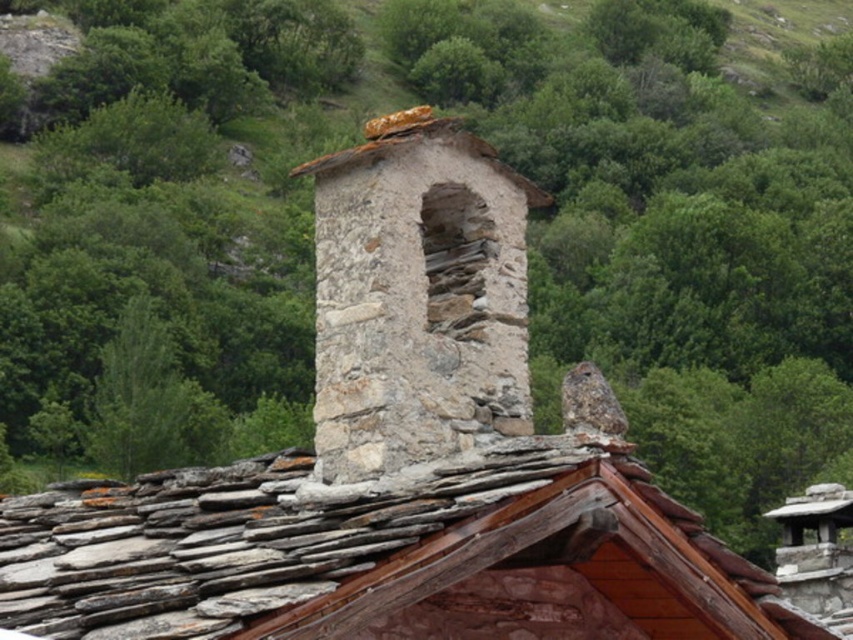
Question: Can you confirm if gray slate tiles at center is positioned to the right of natural stone chimney at center?

Choices:
 (A) yes
 (B) no

Answer: (B)

Question: In this image, where is gray slate tiles at center located relative to natural stone chimney at center?

Choices:
 (A) left
 (B) right

Answer: (A)

Question: Which object is closer to the camera taking this photo?

Choices:
 (A) natural stone chimney at center
 (B) gray slate tiles at center

Answer: (B)

Question: Can you confirm if gray slate tiles at center is positioned below natural stone chimney at center?

Choices:
 (A) no
 (B) yes

Answer: (B)